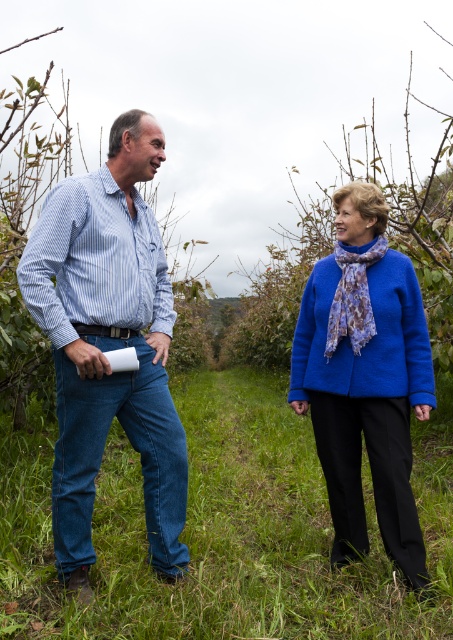
Question: Which of these objects is positioned farthest from the blue woolen sweater at upper center?

Choices:
 (A) lavender floral scarf at center
 (B) green grass at center
 (C) blue woolen jacket at center
 (D) blue striped shirt at left

Answer: (B)

Question: Where is blue woolen jacket at center located in relation to blue woolen sweater at upper center in the image?

Choices:
 (A) left
 (B) right

Answer: (A)

Question: Where is blue woolen sweater at center located in relation to lavender floral scarf at center in the image?

Choices:
 (A) above
 (B) below

Answer: (B)

Question: Which point is closer to the camera?

Choices:
 (A) blue woolen jacket at center
 (B) blue woolen sweater at upper center
 (C) blue striped shirt at left
 (D) blue woolen sweater at center

Answer: (D)

Question: Estimate the real-world distances between objects in this image. Which object is closer to the blue woolen sweater at center?

Choices:
 (A) lavender floral scarf at center
 (B) green grass at center

Answer: (A)

Question: Does blue woolen sweater at center come behind blue woolen jacket at center?

Choices:
 (A) yes
 (B) no

Answer: (B)